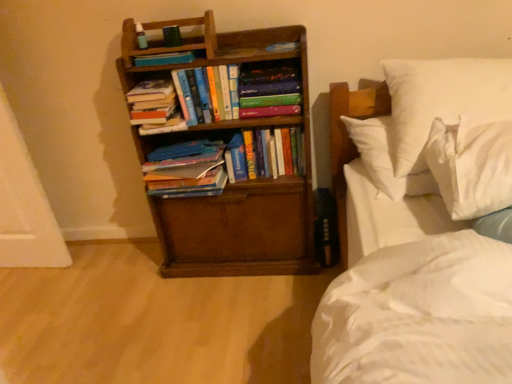
Question: From a real-world perspective, does hardcover book at center, which is the 5th book from left to right, sit lower than hardcover books at left, which is the first book from left to right?

Choices:
 (A) no
 (B) yes

Answer: (A)

Question: Is hardcover book at center, which is the 5th book from left to right, oriented towards hardcover books at left, the 5th book positioned from the right?

Choices:
 (A) yes
 (B) no

Answer: (B)

Question: Can hardcover books at left, which is the first book from left to right, be found inside hardcover book at center, which is the 5th book from left to right?

Choices:
 (A) no
 (B) yes

Answer: (A)

Question: Is hardcover book at center, arranged as the 1th book when viewed from the right, not within hardcover books at left, which is the first book from left to right?

Choices:
 (A) no
 (B) yes

Answer: (B)

Question: Does hardcover book at center, which is the 5th book from left to right, have a greater height compared to hardcover books at left, the 5th book positioned from the right?

Choices:
 (A) yes
 (B) no

Answer: (A)

Question: Is hardcover book at center, which is the 5th book from left to right, far away from hardcover books at left, which is the first book from left to right?

Choices:
 (A) yes
 (B) no

Answer: (B)

Question: Is hardcover books at center, the 2th book positioned from the right, completely or partially outside of brown wooden bookcase at left?

Choices:
 (A) no
 (B) yes

Answer: (A)

Question: Is hardcover books at center, the 2th book positioned from the right, bigger than brown wooden bookcase at left?

Choices:
 (A) yes
 (B) no

Answer: (B)

Question: Is hardcover books at center, the 2th book positioned from the right, oriented towards brown wooden bookcase at left?

Choices:
 (A) no
 (B) yes

Answer: (B)

Question: Can you confirm if hardcover books at center, the 4th book from the left, is wider than brown wooden bookcase at left?

Choices:
 (A) yes
 (B) no

Answer: (B)

Question: Does hardcover books at center, the 2th book positioned from the right, come behind brown wooden bookcase at left?

Choices:
 (A) no
 (B) yes

Answer: (B)

Question: From the image's perspective, does hardcover books at center, the 2th book positioned from the right, appear lower than brown wooden bookcase at left?

Choices:
 (A) yes
 (B) no

Answer: (B)

Question: Is white soft pillow at upper right, the 2th pillow from the front, in front of hardcover books at left, which is the first book from left to right?

Choices:
 (A) yes
 (B) no

Answer: (A)